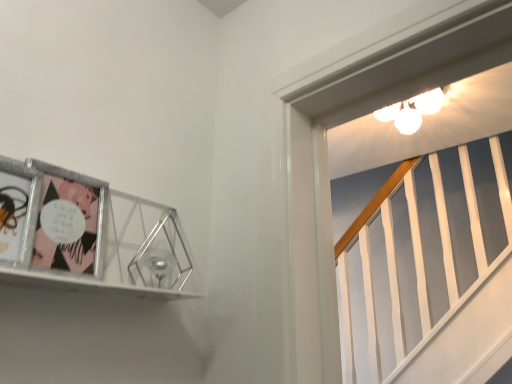
What is the approximate height of matte plastic comic book at left, marked as the 2th comic book in a front-to-back arrangement?

matte plastic comic book at left, marked as the 2th comic book in a front-to-back arrangement, is 7.78 inches in height.

Where is `matte plastic comic book at left, the first comic book positioned from the back`? The height and width of the screenshot is (384, 512). matte plastic comic book at left, the first comic book positioned from the back is located at coordinates [x=69, y=221].

Locate an element on the screen. This screenshot has width=512, height=384. metallic silver picture frame at upper left is located at coordinates (89, 235).

Locate an element on the screen. The height and width of the screenshot is (384, 512). matte plastic comic book at left, marked as the 2th comic book in a front-to-back arrangement is located at coordinates (69, 221).

From the image's perspective, is matte black comic book at left, the second comic book in the back-to-front sequence, located above metallic silver picture frame at upper left?

Yes, from the image's perspective, matte black comic book at left, the second comic book in the back-to-front sequence, is above metallic silver picture frame at upper left.

Is matte black comic book at left, the first comic book when ordered from front to back, directly adjacent to metallic silver picture frame at upper left?

matte black comic book at left, the first comic book when ordered from front to back, is not next to metallic silver picture frame at upper left, and they're not touching.

In the scene shown: Between matte black comic book at left, the first comic book when ordered from front to back, and metallic silver picture frame at upper left, which one has larger width?

metallic silver picture frame at upper left.

Is metallic silver picture frame at upper left bigger than matte black comic book at left, the first comic book when ordered from front to back?

Correct, metallic silver picture frame at upper left is larger in size than matte black comic book at left, the first comic book when ordered from front to back.

Is metallic silver picture frame at upper left not close to matte black comic book at left, the first comic book when ordered from front to back?

No, metallic silver picture frame at upper left is not far away from matte black comic book at left, the first comic book when ordered from front to back.

Locate an element on the screen. This screenshot has height=384, width=512. picture frame on the right of the matte black comic book at left, the second comic book in the back-to-front sequence is located at coordinates (89, 235).

From a real-world perspective, which object rests below the other?

matte black comic book at left, the first comic book when ordered from front to back, from a real-world perspective.

Where is `comic book that is below the matte black comic book at left, the second comic book in the back-to-front sequence (from the image's perspective)`? comic book that is below the matte black comic book at left, the second comic book in the back-to-front sequence (from the image's perspective) is located at coordinates (69, 221).

Does matte black comic book at left, the second comic book in the back-to-front sequence, have a greater width compared to matte plastic comic book at left, marked as the 2th comic book in a front-to-back arrangement?

No.

Considering the positions of points (31, 234) and (81, 229), is point (31, 234) closer to camera compared to point (81, 229)?

Yes.

Considering the relative positions of metallic silver picture frame at upper left and matte plastic comic book at left, marked as the 2th comic book in a front-to-back arrangement, in the image provided, is metallic silver picture frame at upper left to the left or to the right of matte plastic comic book at left, marked as the 2th comic book in a front-to-back arrangement,?

Based on their positions, metallic silver picture frame at upper left is located to the right of matte plastic comic book at left, marked as the 2th comic book in a front-to-back arrangement.

The width and height of the screenshot is (512, 384). I want to click on the 1st comic book to the left when counting from the metallic silver picture frame at upper left, so click(69, 221).

Can you tell me how much metallic silver picture frame at upper left and matte plastic comic book at left, the first comic book positioned from the back, differ in facing direction?

2.74 degrees.

From a real-world perspective, who is located lower, matte plastic comic book at left, the first comic book positioned from the back, or metallic silver picture frame at upper left?

From a 3D spatial view, metallic silver picture frame at upper left is below.

Is matte plastic comic book at left, marked as the 2th comic book in a front-to-back arrangement, directly adjacent to metallic silver picture frame at upper left?

Yes, matte plastic comic book at left, marked as the 2th comic book in a front-to-back arrangement, is with metallic silver picture frame at upper left.

Is matte plastic comic book at left, marked as the 2th comic book in a front-to-back arrangement, positioned with its back to metallic silver picture frame at upper left?

Yes, matte plastic comic book at left, marked as the 2th comic book in a front-to-back arrangement, is facing away from metallic silver picture frame at upper left.

Is point (103, 190) closer or farther from the camera than point (6, 159)?

Point (103, 190) is positioned farther from the camera compared to point (6, 159).

Which is behind, matte plastic comic book at left, the first comic book positioned from the back, or matte black comic book at left, the second comic book in the back-to-front sequence?

matte plastic comic book at left, the first comic book positioned from the back, is further from the camera.

Is matte plastic comic book at left, marked as the 2th comic book in a front-to-back arrangement, oriented towards matte black comic book at left, the first comic book when ordered from front to back?

No, matte plastic comic book at left, marked as the 2th comic book in a front-to-back arrangement, is not turned towards matte black comic book at left, the first comic book when ordered from front to back.

From the image's perspective, which one is positioned higher, matte plastic comic book at left, marked as the 2th comic book in a front-to-back arrangement, or matte black comic book at left, the second comic book in the back-to-front sequence?

matte black comic book at left, the second comic book in the back-to-front sequence, from the image's perspective.

From a real-world perspective, is matte plastic comic book at left, the first comic book positioned from the back, beneath matte black comic book at left, the second comic book in the back-to-front sequence?

No, from a real-world perspective, matte plastic comic book at left, the first comic book positioned from the back, is not under matte black comic book at left, the second comic book in the back-to-front sequence.

Find the location of a particular element. the 1st comic book behind the metallic silver picture frame at upper left is located at coordinates (17, 211).

I want to click on picture frame above the matte black comic book at left, the first comic book when ordered from front to back (from a real-world perspective), so click(89, 235).

Looking at the image, which one is located further to metallic silver picture frame at upper left, matte black comic book at left, the first comic book when ordered from front to back, or matte plastic comic book at left, the first comic book positioned from the back?

matte black comic book at left, the first comic book when ordered from front to back, is positioned further to the anchor metallic silver picture frame at upper left.

Looking at the image, which one is located further to metallic silver picture frame at upper left, matte plastic comic book at left, marked as the 2th comic book in a front-to-back arrangement, or matte black comic book at left, the first comic book when ordered from front to back?

matte black comic book at left, the first comic book when ordered from front to back, is further to metallic silver picture frame at upper left.

Looking at the image, which one is located closer to matte plastic comic book at left, the first comic book positioned from the back, metallic silver picture frame at upper left or matte black comic book at left, the second comic book in the back-to-front sequence?

Among the two, metallic silver picture frame at upper left is located nearer to matte plastic comic book at left, the first comic book positioned from the back.

Estimate the real-world distances between objects in this image. Which object is further from matte black comic book at left, the second comic book in the back-to-front sequence, metallic silver picture frame at upper left or matte plastic comic book at left, the first comic book positioned from the back?

The object further to matte black comic book at left, the second comic book in the back-to-front sequence, is metallic silver picture frame at upper left.

Which object lies further to the anchor point matte plastic comic book at left, the first comic book positioned from the back, matte black comic book at left, the second comic book in the back-to-front sequence, or metallic silver picture frame at upper left?

Based on the image, matte black comic book at left, the second comic book in the back-to-front sequence, appears to be further to matte plastic comic book at left, the first comic book positioned from the back.

Looking at this image, which object lies further to the anchor point matte black comic book at left, the second comic book in the back-to-front sequence, matte plastic comic book at left, marked as the 2th comic book in a front-to-back arrangement, or metallic silver picture frame at upper left?

metallic silver picture frame at upper left.

You are a GUI agent. You are given a task and a screenshot of the screen. Output one action in this format:
    pyautogui.click(x=<x>, y=<y>)
    Task: Click on the comic book between matte black comic book at left, the second comic book in the back-to-front sequence, and metallic silver picture frame at upper left, in the horizontal direction
    The height and width of the screenshot is (384, 512).
    Given the screenshot: What is the action you would take?
    pyautogui.click(x=69, y=221)